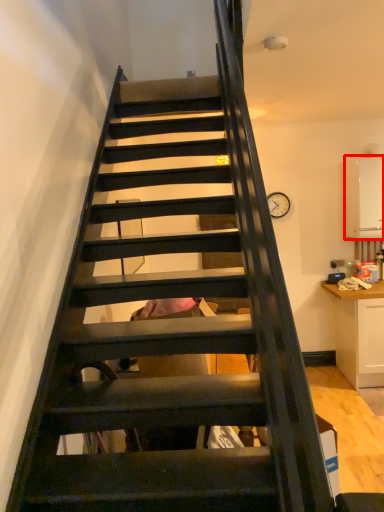
Question: From the image's perspective, what is the correct spatial positioning of appliance (annotated by the red box) in reference to cardboard box?

Choices:
 (A) below
 (B) above

Answer: (B)